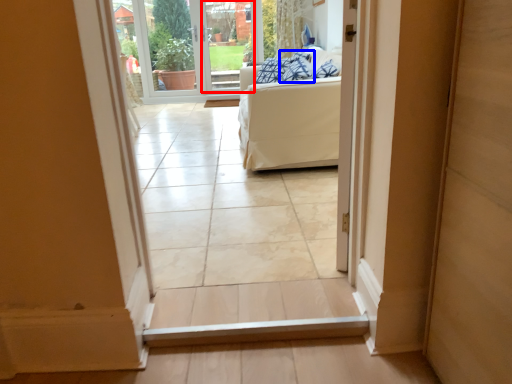
Question: Which point is closer to the camera, glass door (highlighted by a red box) or pillow (highlighted by a blue box)?

Choices:
 (A) glass door
 (B) pillow

Answer: (B)